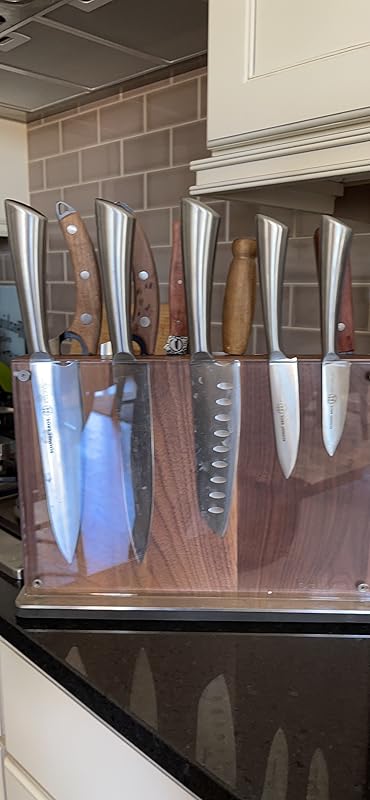
This screenshot has height=800, width=370. What are the coordinates of `silver handle bolts` in the screenshot? It's located at (83, 273).